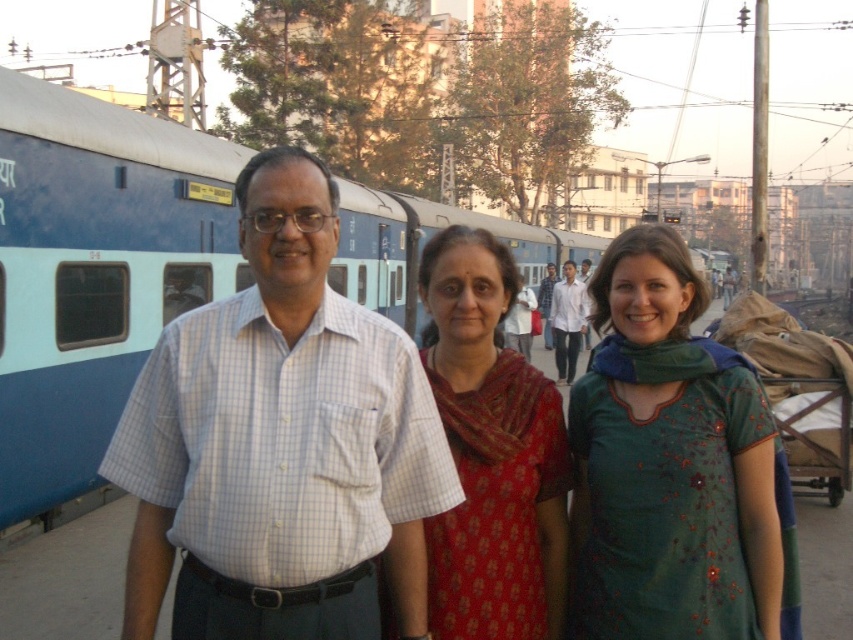
Question: Estimate the real-world distances between objects in this image. Which object is closer to the red silk saree at center?

Choices:
 (A) blue painted metal train at left
 (B) white shirt at center
 (C) green cotton dress at center
 (D) light blue checkered shirt at center

Answer: (C)

Question: Considering the relative positions of light blue checkered shirt at center and blue painted metal train at left in the image provided, where is light blue checkered shirt at center located with respect to blue painted metal train at left?

Choices:
 (A) above
 (B) below

Answer: (B)

Question: Which object is closer to the camera taking this photo?

Choices:
 (A) green cotton dress at center
 (B) blue painted metal train at left

Answer: (A)

Question: Is blue painted metal train at left wider than white shirt at center?

Choices:
 (A) yes
 (B) no

Answer: (A)

Question: Which point appears farthest from the camera in this image?

Choices:
 (A) coord(724,586)
 (B) coord(193,550)
 (C) coord(572,273)

Answer: (C)

Question: Does green cotton dress at center appear under white shirt at center?

Choices:
 (A) no
 (B) yes

Answer: (A)